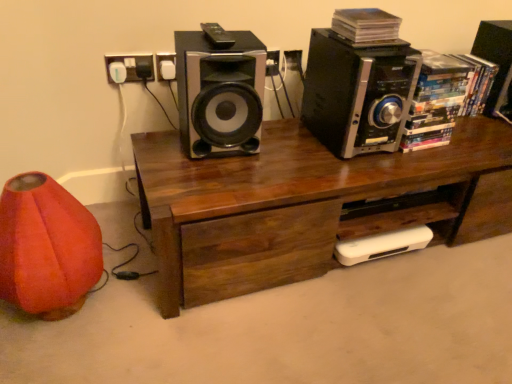
I want to click on vacant space situated above wooden desk at center (from a real-world perspective), so click(x=346, y=156).